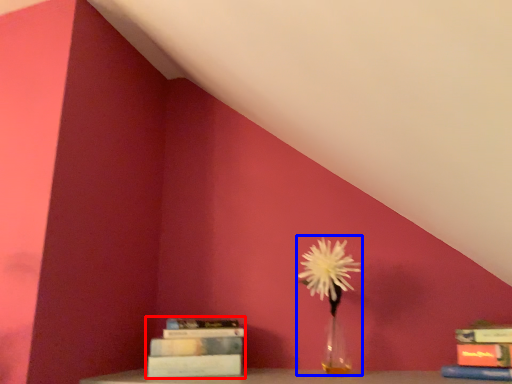
Question: Which object appears farthest to the camera in this image, book (highlighted by a red box) or floral arrangement (highlighted by a blue box)?

Choices:
 (A) book
 (B) floral arrangement

Answer: (A)